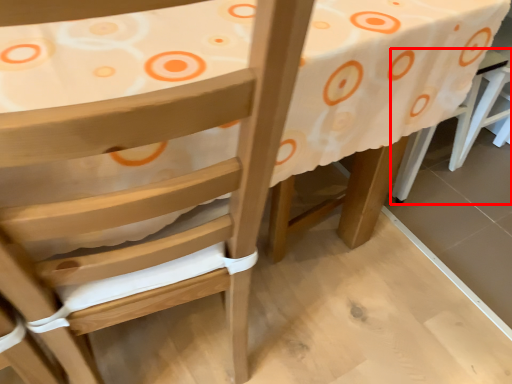
Question: From the image's perspective, what is the correct spatial positioning of chair (annotated by the red box) in reference to table?

Choices:
 (A) below
 (B) above

Answer: (B)